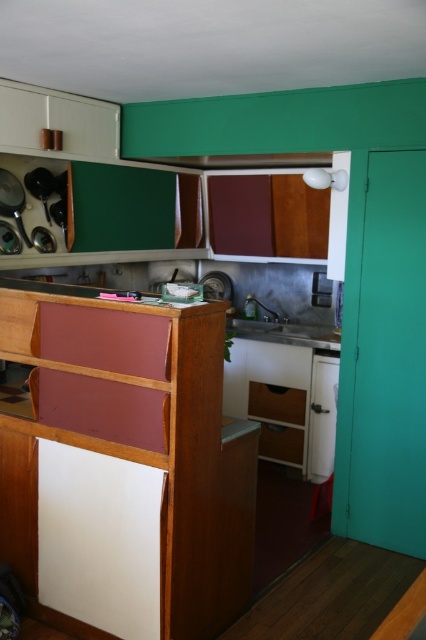
Who is more distant from viewer, (294, 342) or (264, 417)?

Positioned behind is point (264, 417).

Does satin silver sink at center appear under matte wood drawer at center?

No, satin silver sink at center is not below matte wood drawer at center.

Which is behind, point (241, 330) or point (293, 392)?

Positioned behind is point (241, 330).

Find the location of a particular element. The height and width of the screenshot is (640, 426). satin silver sink at center is located at coordinates (284, 332).

How much distance is there between matte wood drawer at center and wooden drawer at center?

A distance of 7.27 inches exists between matte wood drawer at center and wooden drawer at center.

Does matte wood drawer at center appear on the left side of wooden drawer at center?

Indeed, matte wood drawer at center is positioned on the left side of wooden drawer at center.

Is point (305, 410) more distant than point (293, 460)?

No, it is not.

Locate an element on the screen. The image size is (426, 640). matte wood drawer at center is located at coordinates (276, 403).

Who is positioned more to the left, satin silver sink at center or wooden drawer at center?

wooden drawer at center is more to the left.

Measure the distance between satin silver sink at center and wooden drawer at center.

33.55 inches

Is point (328, 346) closer to camera compared to point (290, 448)?

Yes.

Where is `satin silver sink at center`? This screenshot has height=640, width=426. satin silver sink at center is located at coordinates (284, 332).